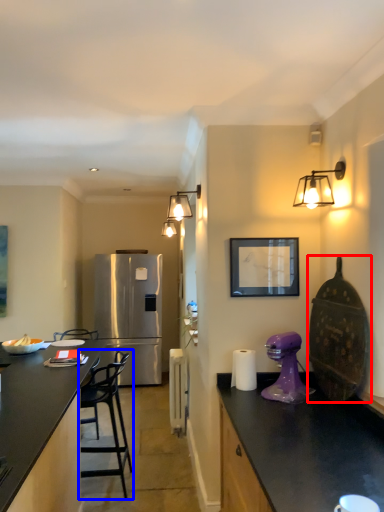
Question: Which object is further to the camera taking this photo, appliance (highlighted by a red box) or chair (highlighted by a blue box)?

Choices:
 (A) appliance
 (B) chair

Answer: (B)